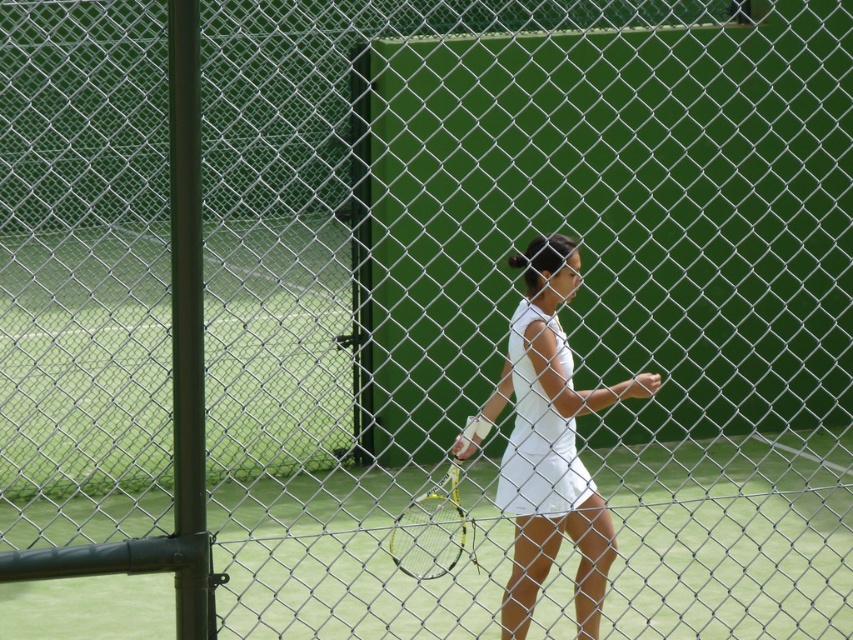
You are a photographer standing at the camera position. You want to take a photo of the tennis player but need to ensure you are within the 7 meter safety zone to avoid tripping over equipment. Is the distance from your position to the tennis player at point [607,548] within the 7 meter safety zone?

The distance between the camera and the tennis player at point [607,548] is 6.53 meters, which is within the 7 meter safety zone.

You are a photographer trying to capture the tennis player in action. You notice the white matte dress at center and the green metallic racket at center. Which object is positioned higher in the image?

The white matte dress at center is much taller than the green metallic racket at center, so the white matte dress at center is positioned higher in the image.